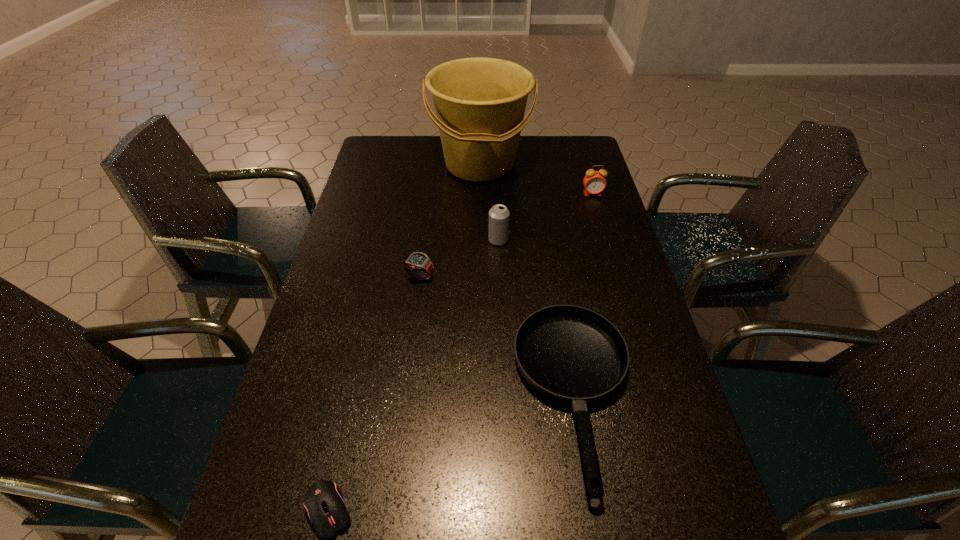
Locate an element on the screen. Image resolution: width=960 pixels, height=540 pixels. free space between the fifth tallest object and the alarm clock is located at coordinates (584, 295).

Where is `free space between the tallest object and the alarm clock`? Image resolution: width=960 pixels, height=540 pixels. free space between the tallest object and the alarm clock is located at coordinates (537, 179).

Image resolution: width=960 pixels, height=540 pixels. Identify the location of vacant area that lies between the third shortest object and the bucket. (450, 220).

Identify which object is the fourth closest to the third shortest object. Please provide its 2D coordinates. Your answer should be formatted as a tuple, i.e. [(x, y)], where the tuple contains the x and y coordinates of a point satisfying the conditions above.

[(324, 503)]

The height and width of the screenshot is (540, 960). What are the coordinates of `object that can be found as the second closest to the fourth farthest object` in the screenshot? It's located at (569, 354).